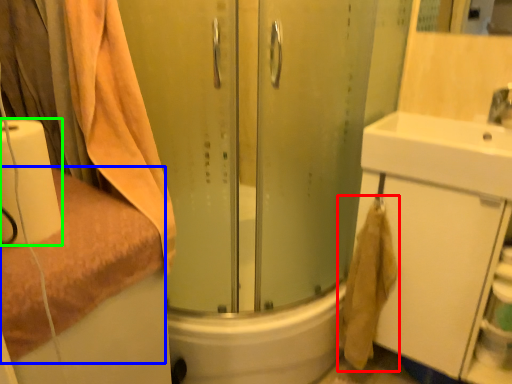
Question: Considering the real-world distances, which object is closest to bath towel (highlighted by a red box)? towel (highlighted by a blue box) or toilet paper (highlighted by a green box).

Choices:
 (A) towel
 (B) toilet paper

Answer: (A)